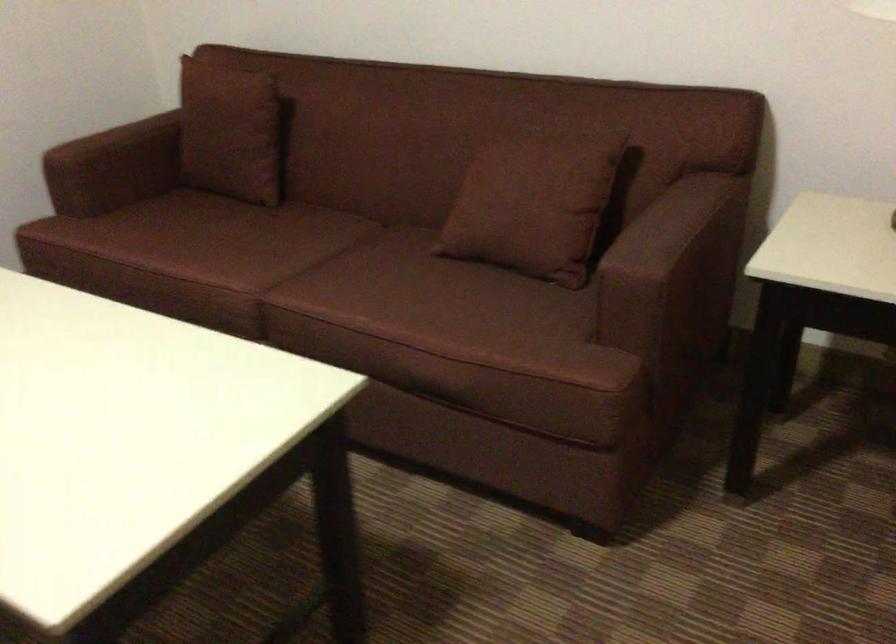
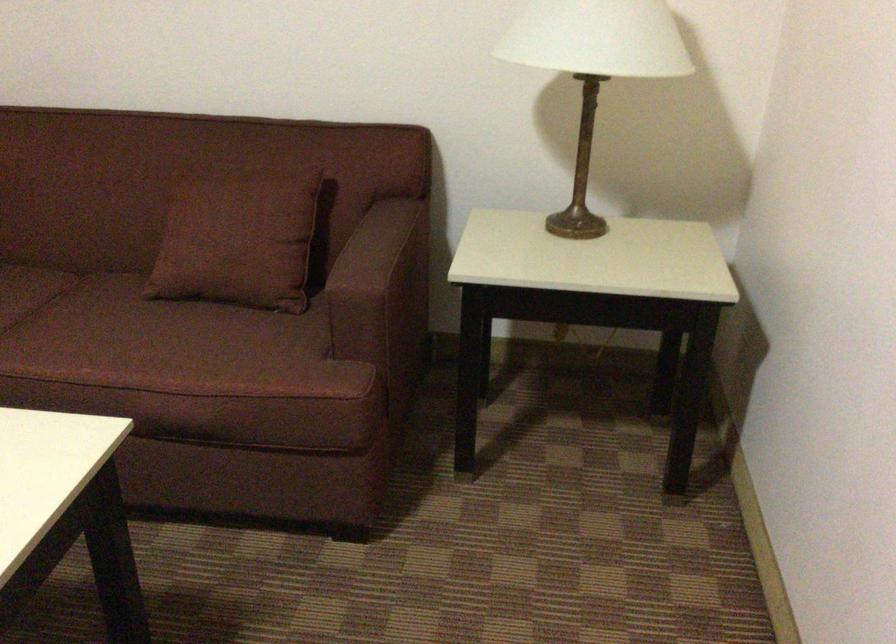
Find the pixel in the second image that matches pixel 527 196 in the first image.

(238, 234)